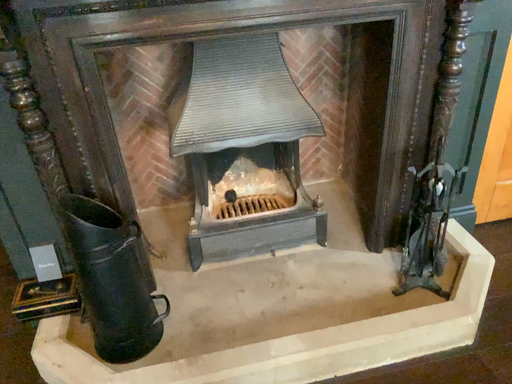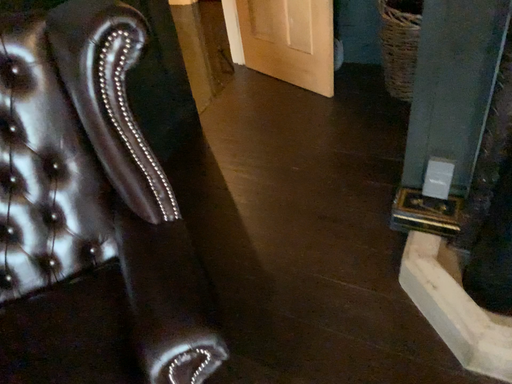
Question: How did the camera likely rotate when shooting the video?

Choices:
 (A) rotated upward
 (B) rotated downward

Answer: (B)